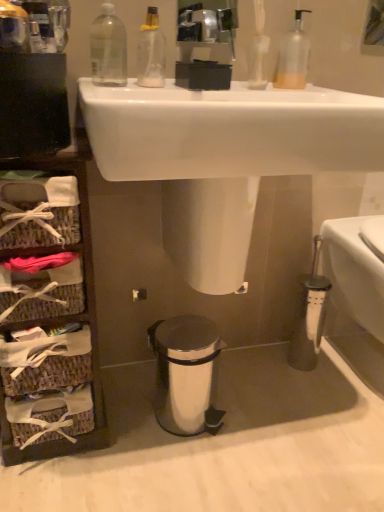
What are the coordinates of `spots to the right of woven brown basket at left` in the screenshot? It's located at (143, 436).